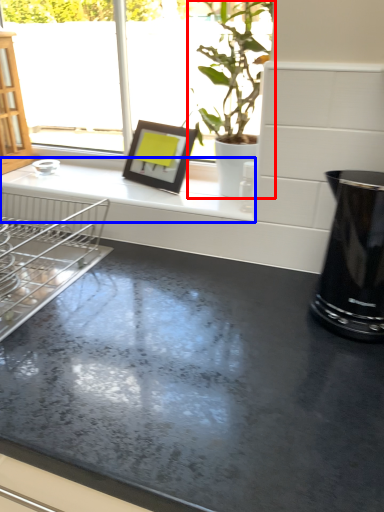
Question: Which object is further to the camera taking this photo, houseplant (highlighted by a red box) or counter top (highlighted by a blue box)?

Choices:
 (A) houseplant
 (B) counter top

Answer: (B)